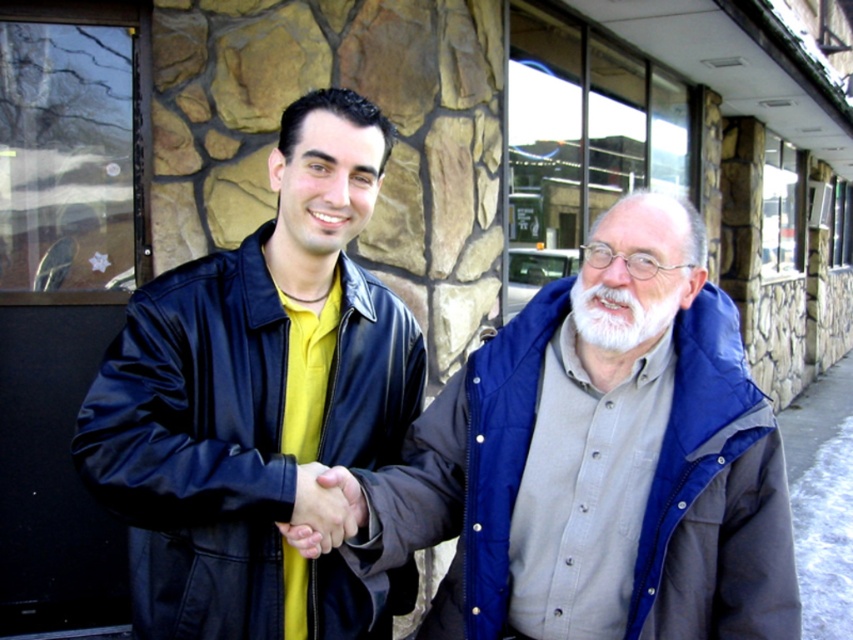
Question: Where is matte black jacket at left located in relation to blue quilted jacket at center in the image?

Choices:
 (A) left
 (B) right

Answer: (A)

Question: Which point is closer to the camera?

Choices:
 (A) (332, 512)
 (B) (601, 284)

Answer: (A)

Question: Is gray concrete pavement at lower right below smooth leather hand at center?

Choices:
 (A) yes
 (B) no

Answer: (A)

Question: Is matte black jacket at left smaller than gray concrete pavement at lower right?

Choices:
 (A) yes
 (B) no

Answer: (B)

Question: Which of these objects is positioned farthest from the smooth leather hand at center?

Choices:
 (A) blue quilted jacket at center
 (B) matte black jacket at left
 (C) whitehairbeard at center

Answer: (C)

Question: Which of the following is the farthest from the observer?

Choices:
 (A) gray concrete pavement at lower right
 (B) smooth leather hand at center
 (C) matte black jacket at left
 (D) blue quilted jacket at center

Answer: (A)